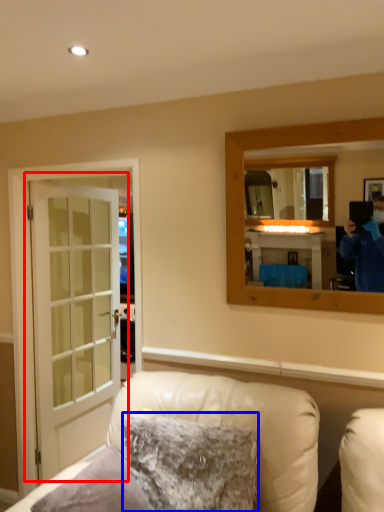
Question: Which point is closer to the camera, door (highlighted by a red box) or pillow (highlighted by a blue box)?

Choices:
 (A) door
 (B) pillow

Answer: (B)